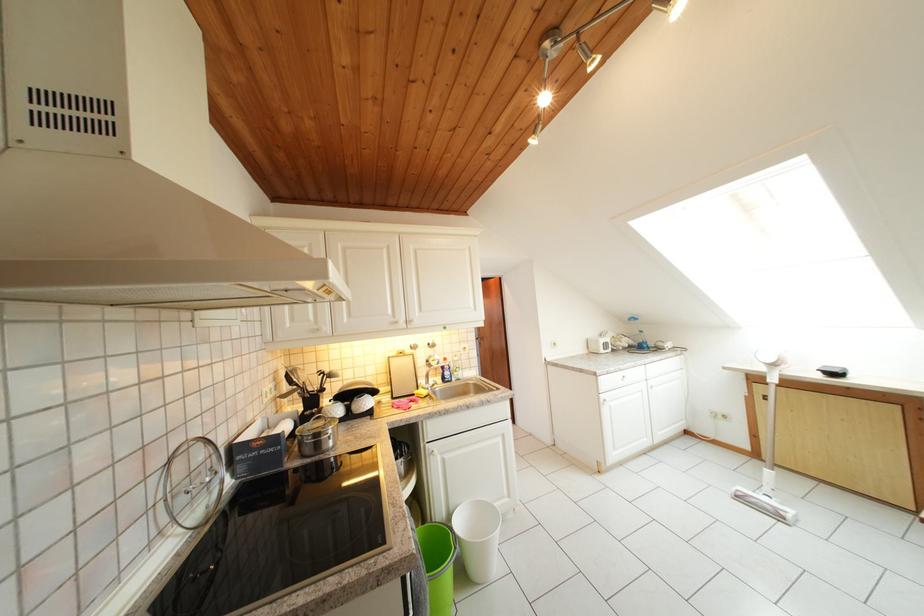
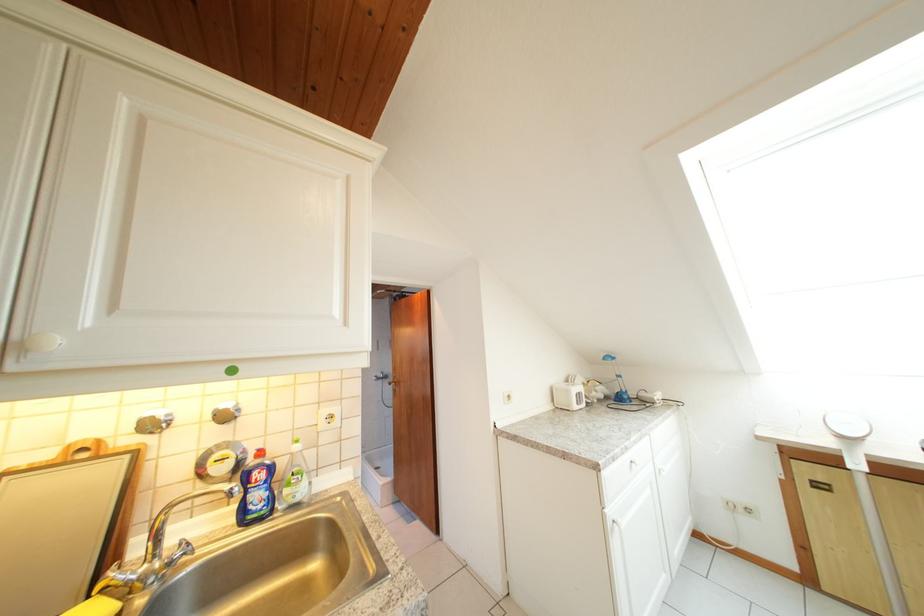
Where in the second image is the point corresponding to the point at 422,352 from the first image?

(162, 431)